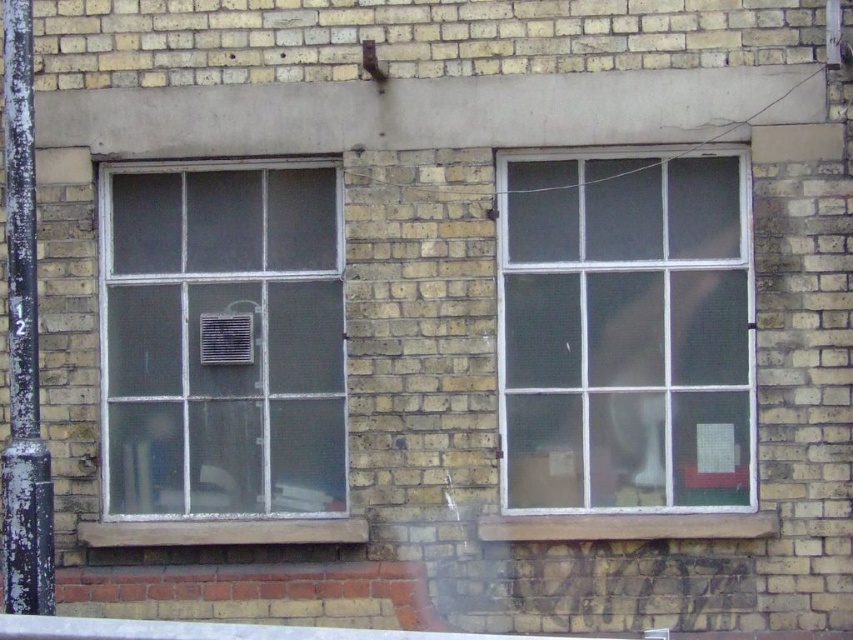
You are a window cleaner standing on a ladder. You need to clean both the clear glass window at left and the clear glass window at right. Given that your ladder can only reach a maximum distance of 25 inches between two points, can you safely clean both windows without moving the ladder?

The distance between the clear glass window at right and clear glass window at left is 25.53 inches, which exceeds the ladder maximum reach of 25 inches. Therefore, you cannot safely clean both windows without moving the ladder.

You are standing in front of a building and see the clear glass window at right. Can you estimate its position using a coordinate system where the bottom left corner is the origin?

The clear glass window at right is located at coordinates approximately 0.517 on the x axis and 0.733 on the y axis.

In the scene shown: You are a window installer and need to replace the glass panels for both the clear glass window at right and the clear glass window at left. Based on the scene description, which window might require a wider glass panel?

The clear glass window at right might require a wider glass panel since it might be wider than the clear glass window at left according to the description.